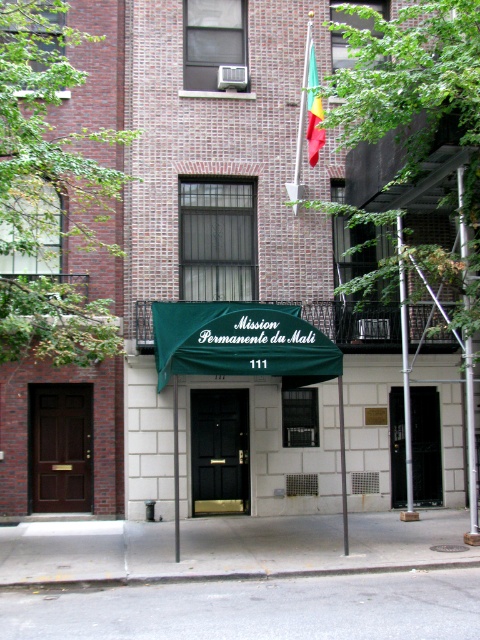
Question: Where is green fabric pole at center located in relation to black metal pole at center in the image?

Choices:
 (A) below
 (B) above

Answer: (A)

Question: Which is farther from the metal scaffolding at center right?

Choices:
 (A) metallic silver flag pole at upper center
 (B) black glass door at center
 (C) black metal pole at center
 (D) brown wooden door at left

Answer: (A)

Question: Which point is closer to the camera?

Choices:
 (A) (212, 433)
 (B) (172, 396)
 (C) (430, 476)
 (D) (43, 404)

Answer: (B)

Question: Which object appears farthest from the camera in this image?

Choices:
 (A) silver metallic pole at right
 (B) black glossy door at center

Answer: (B)

Question: Does black glossy door at center appear on the left side of metal scaffolding at center right?

Choices:
 (A) no
 (B) yes

Answer: (B)

Question: Is brown wooden door at left positioned behind multicolored fabric flag at upper center?

Choices:
 (A) no
 (B) yes

Answer: (B)